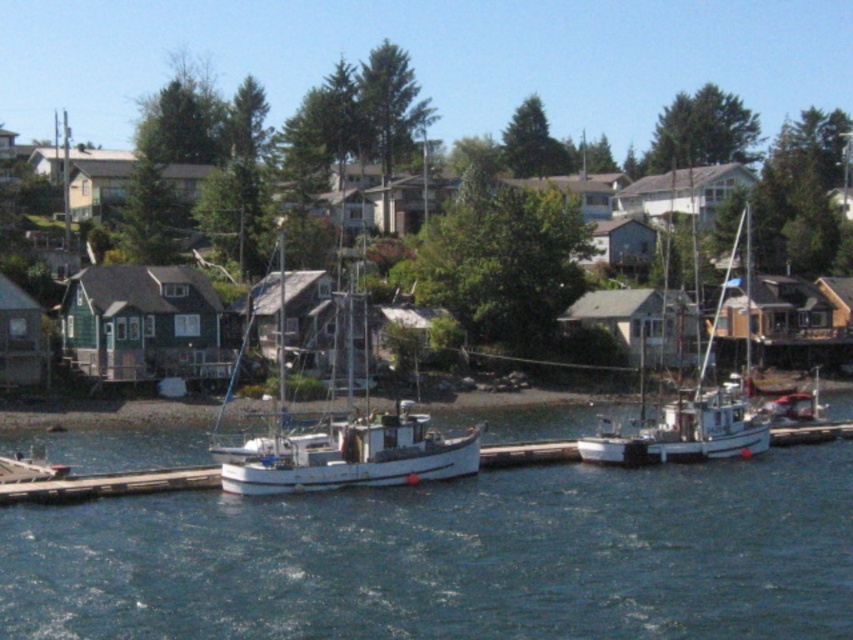
Between white matte boat at center and white matte sailboat at center, which one is positioned higher?

white matte sailboat at center is higher up.

Where is `white matte boat at center`? Image resolution: width=853 pixels, height=640 pixels. white matte boat at center is located at coordinates click(x=357, y=458).

Who is lower down, blue water at center or white matte boat at center?

blue water at center is lower down.

The width and height of the screenshot is (853, 640). In order to click on blue water at center in this screenshot , I will do `click(453, 557)`.

Is point (425, 602) more distant than point (337, 472)?

That is False.

At what (x,y) coordinates should I click in order to perform the action: click on blue water at center. Please return your answer as a coordinate pair (x, y). Looking at the image, I should click on (453, 557).

Does blue water at center have a greater height compared to white matte sailboat at center?

In fact, blue water at center may be shorter than white matte sailboat at center.

Does blue water at center lie in front of white matte sailboat at center?

Yes, blue water at center is closer to the viewer.

Between point (675, 570) and point (682, 416), which one is positioned in front?

Point (675, 570) is in front.

What are the coordinates of `blue water at center` in the screenshot? It's located at (453, 557).